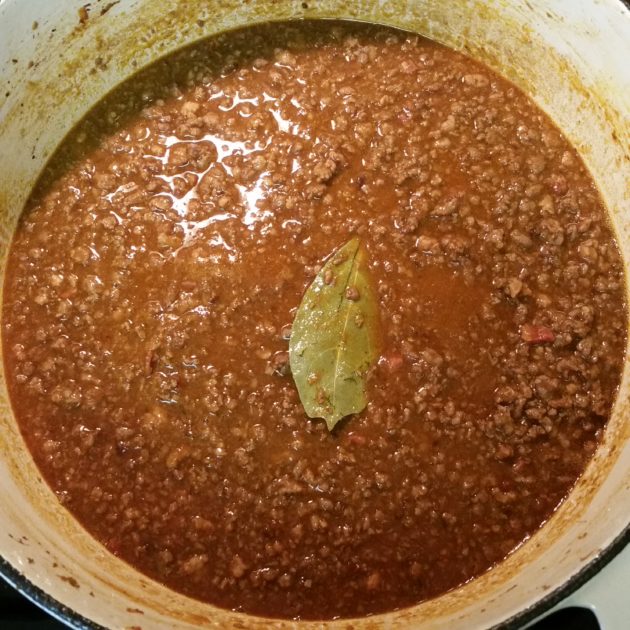
Identify the location of inner portion of bowl. (92, 593).